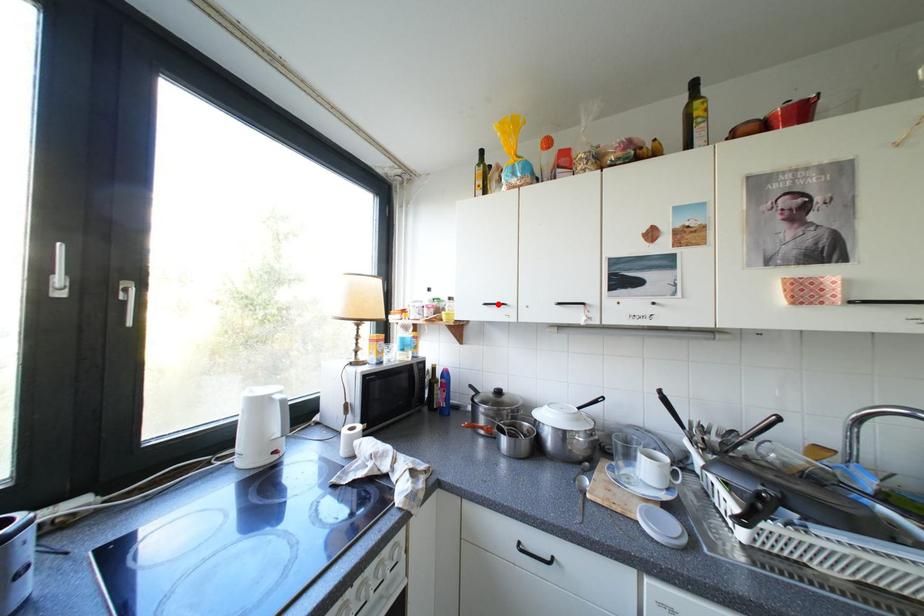
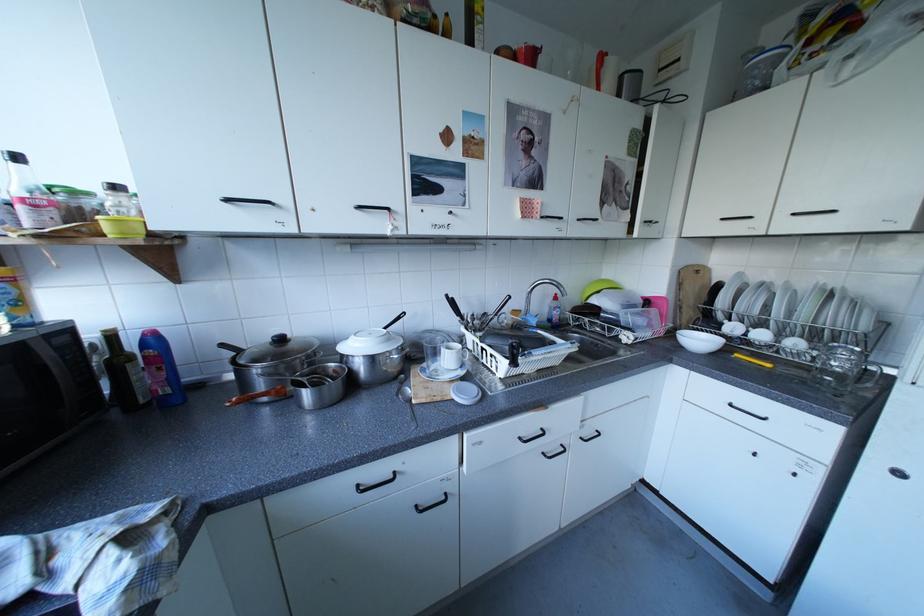
In the second image, find the point that corresponds to the highlighted location in the first image.

(240, 200)